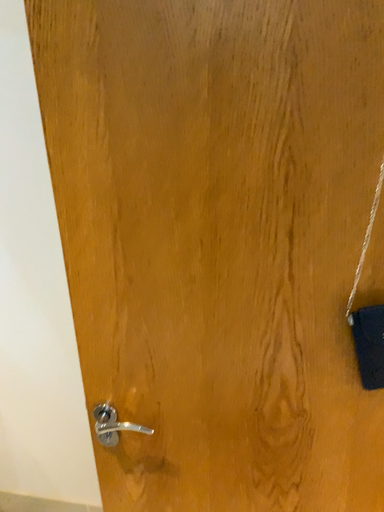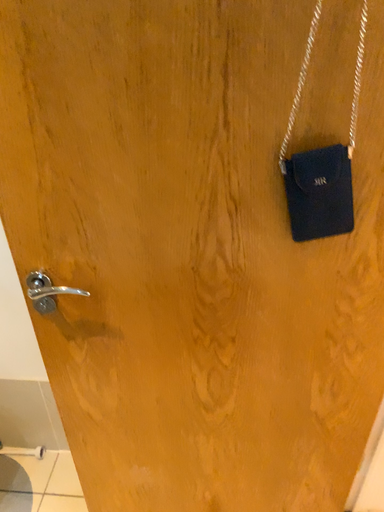
Question: Which way did the camera rotate in the video?

Choices:
 (A) rotated right
 (B) rotated left

Answer: (A)